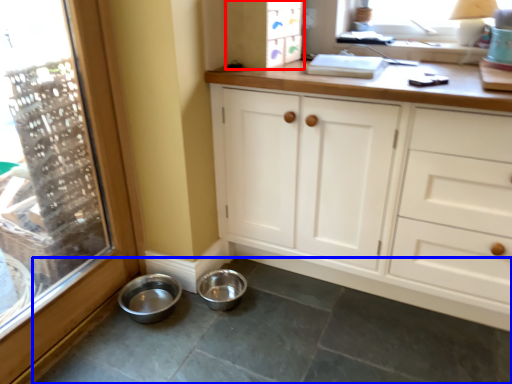
Question: Which point is closer to the camera, cabinetry (highlighted by a red box) or concrete (highlighted by a blue box)?

Choices:
 (A) cabinetry
 (B) concrete

Answer: (B)